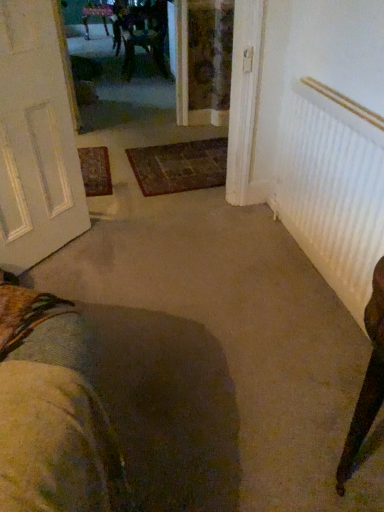
Question: From the image's perspective, does white textured door at left appear lower than carpeted doormat at center?

Choices:
 (A) no
 (B) yes

Answer: (B)

Question: Is white textured door at left located outside carpeted doormat at center?

Choices:
 (A) yes
 (B) no

Answer: (A)

Question: From a real-world perspective, does white textured door at left sit lower than carpeted doormat at center?

Choices:
 (A) yes
 (B) no

Answer: (B)

Question: Does white textured door at left have a lesser width compared to carpeted doormat at center?

Choices:
 (A) no
 (B) yes

Answer: (B)

Question: Does white textured door at left contain carpeted doormat at center?

Choices:
 (A) no
 (B) yes

Answer: (A)

Question: Is white textured door at left facing away from carpeted doormat at center?

Choices:
 (A) no
 (B) yes

Answer: (A)

Question: Is white ribbed radiator at right behind carpeted doormat at center?

Choices:
 (A) no
 (B) yes

Answer: (A)

Question: Does white ribbed radiator at right appear on the right side of carpeted doormat at center?

Choices:
 (A) yes
 (B) no

Answer: (A)

Question: Could you tell me if white ribbed radiator at right is facing carpeted doormat at center?

Choices:
 (A) no
 (B) yes

Answer: (A)

Question: Does white ribbed radiator at right have a greater width compared to carpeted doormat at center?

Choices:
 (A) yes
 (B) no

Answer: (B)

Question: Considering the relative sizes of white ribbed radiator at right and carpeted doormat at center in the image provided, is white ribbed radiator at right bigger than carpeted doormat at center?

Choices:
 (A) yes
 (B) no

Answer: (A)

Question: Would you say white ribbed radiator at right contains carpeted doormat at center?

Choices:
 (A) no
 (B) yes

Answer: (A)

Question: From the image's perspective, is wooden chair at upper center below white ribbed radiator at right?

Choices:
 (A) yes
 (B) no

Answer: (B)